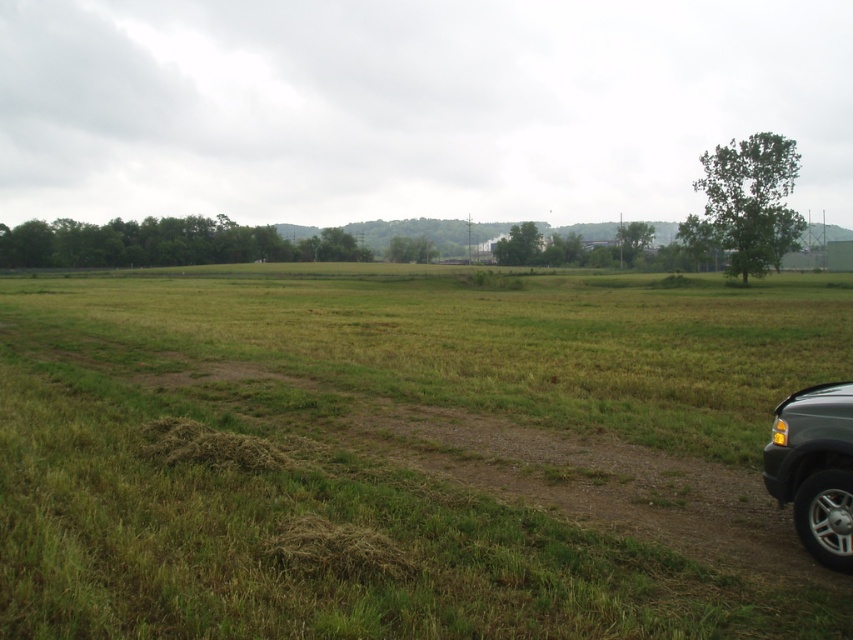
Is green grassy field at center shorter than metallic gray suv at lower right?

Incorrect, green grassy field at center's height does not fall short of metallic gray suv at lower right's.

Which is in front, point (318, 529) or point (792, 488)?

Point (318, 529) is in front.

Does point (543, 454) come behind point (834, 520)?

Yes, it is.

This screenshot has height=640, width=853. Identify the location of green grassy field at center. (409, 454).